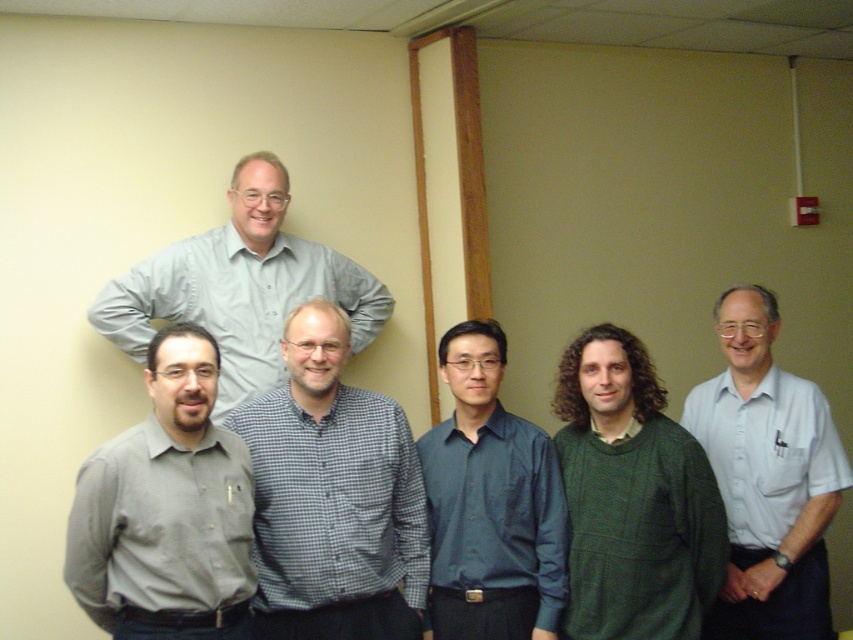
Based on the photo, can you confirm if gray matte shirt at lower left is thinner than light gray shirt at upper center?

Yes, gray matte shirt at lower left is thinner than light gray shirt at upper center.

Who is positioned more to the right, gray matte shirt at lower left or light gray shirt at upper center?

From the viewer's perspective, light gray shirt at upper center appears more on the right side.

At what (x,y) coordinates should I click in order to perform the action: click on gray matte shirt at lower left. Please return your answer as a coordinate pair (x, y). The image size is (853, 640). Looking at the image, I should click on (166, 509).

Is gray matte shirt at lower left thinner than green knitted sweater at center?

Incorrect, gray matte shirt at lower left's width is not less than green knitted sweater at center's.

What do you see at coordinates (166, 509) in the screenshot?
I see `gray matte shirt at lower left` at bounding box center [166, 509].

The width and height of the screenshot is (853, 640). Find the location of `gray matte shirt at lower left`. gray matte shirt at lower left is located at coordinates (166, 509).

Is gray checkered shirt at center positioned behind green knitted sweater at center?

Yes, it is behind green knitted sweater at center.

Does gray checkered shirt at center have a larger size compared to green knitted sweater at center?

Yes.

Is point (373, 481) closer to camera compared to point (613, 564)?

No, (373, 481) is further to viewer.

Where is `gray checkered shirt at center`? This screenshot has width=853, height=640. gray checkered shirt at center is located at coordinates (332, 497).